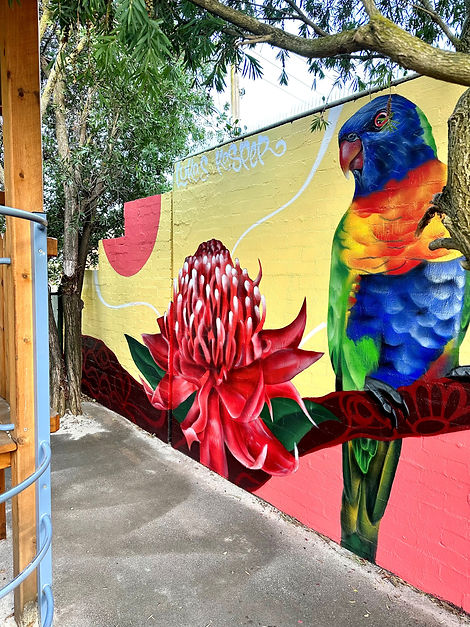
The height and width of the screenshot is (627, 470). I want to click on wooden pillar, so [22, 161].